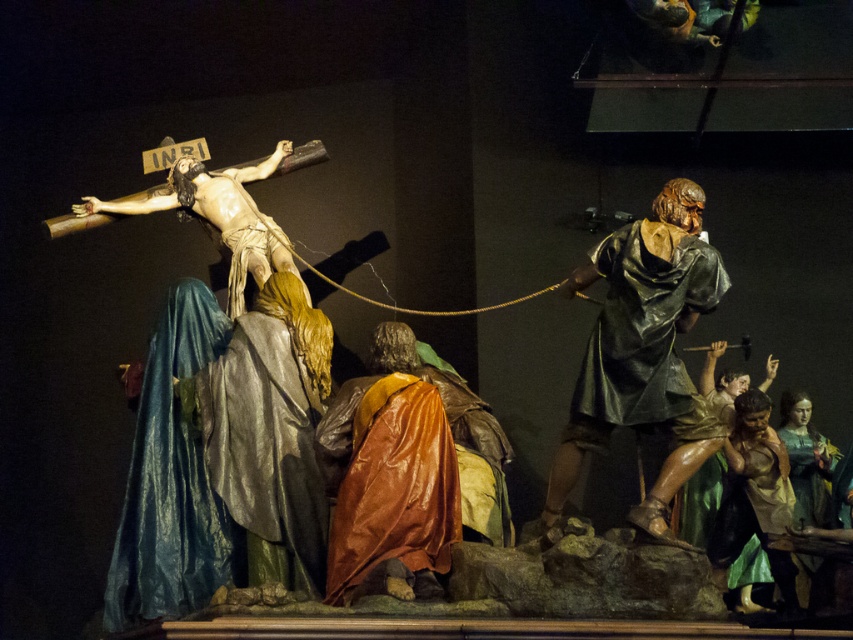
Question: Estimate the real-world distances between objects in this image. Which object is farther from the shiny bronze helmet at right?

Choices:
 (A) brown leather robe at lower right
 (B) smooth green fabric at lower right
 (C) brown leather robe at center

Answer: (B)

Question: Is shiny bronze helmet at right wider than brown leather robe at center?

Choices:
 (A) yes
 (B) no

Answer: (A)

Question: Is brown leather robe at center to the left of brown leather robe at lower right from the viewer's perspective?

Choices:
 (A) yes
 (B) no

Answer: (A)

Question: Observing the image, what is the correct spatial positioning of shiny bronze helmet at right in reference to smooth green fabric at lower right?

Choices:
 (A) left
 (B) right

Answer: (A)

Question: Which point is farther from the camera taking this photo?

Choices:
 (A) tap(675, 257)
 (B) tap(729, 545)
 (C) tap(405, 547)
 (D) tap(817, 484)

Answer: (D)

Question: Among these objects, which one is nearest to the camera?

Choices:
 (A) brown leather robe at center
 (B) shiny bronze helmet at right
 (C) smooth wood crucifix at upper left
 (D) brown leather robe at lower right

Answer: (A)